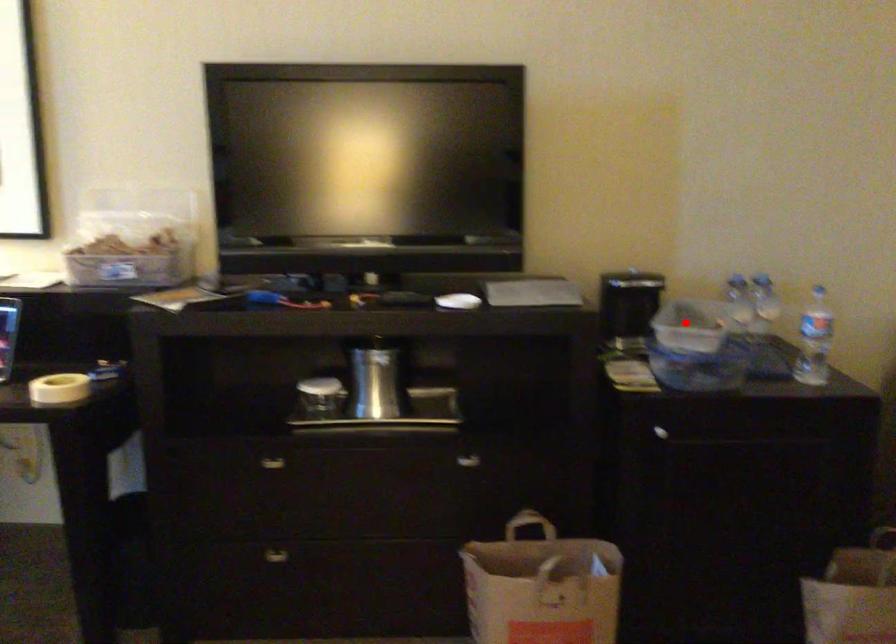
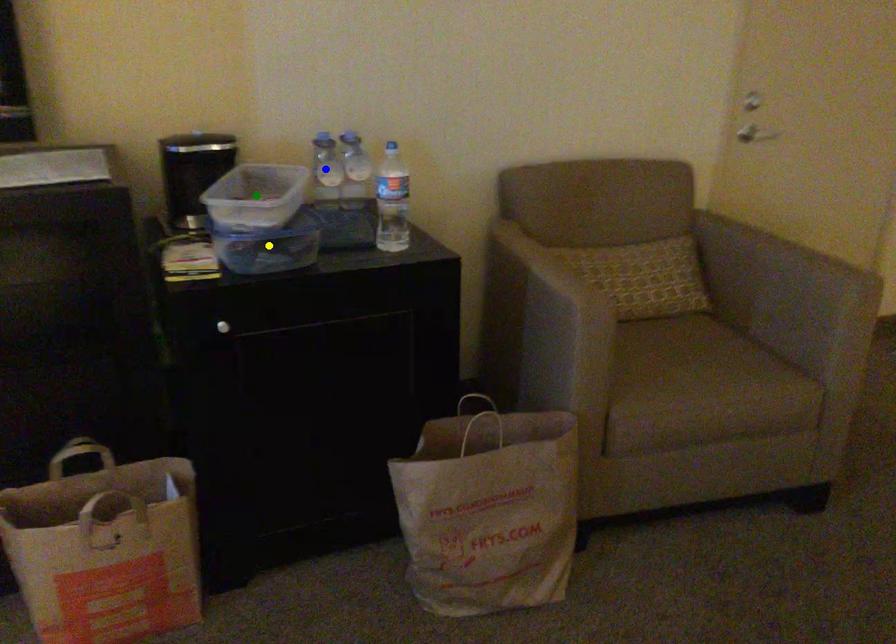
Question: I am providing you with two images of the same scene from different viewpoints. A red point is marked on the first image. You are given multiple points on the second image. Which point in image 2 represents the same 3d spot as the red point in image 1?

Choices:
 (A) green point
 (B) blue point
 (C) yellow point

Answer: (A)